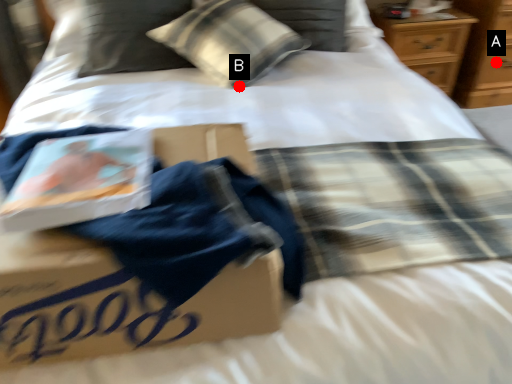
Question: Two points are circled on the image, labeled by A and B beside each circle. Which point is closer to the camera?

Choices:
 (A) A is closer
 (B) B is closer

Answer: (B)